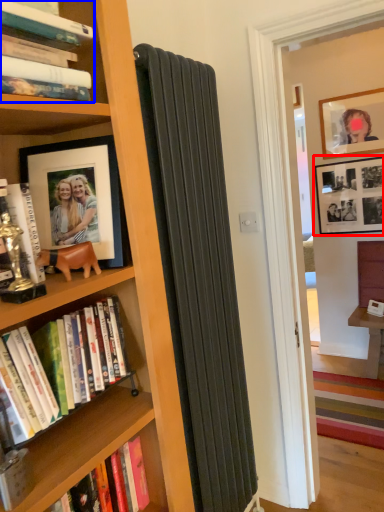
Question: Which object appears closest to the camera in this image, picture frame (highlighted by a red box) or book (highlighted by a blue box)?

Choices:
 (A) picture frame
 (B) book

Answer: (B)